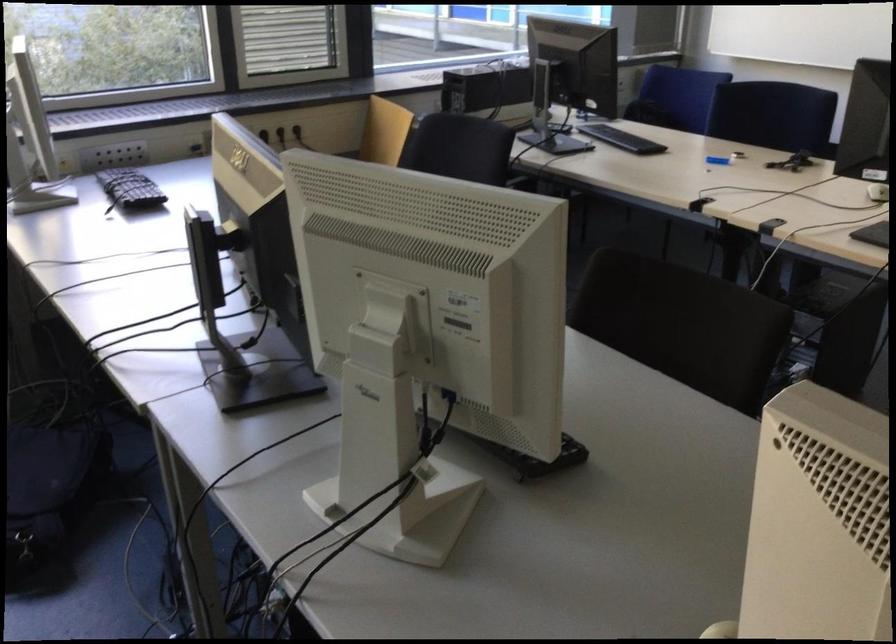
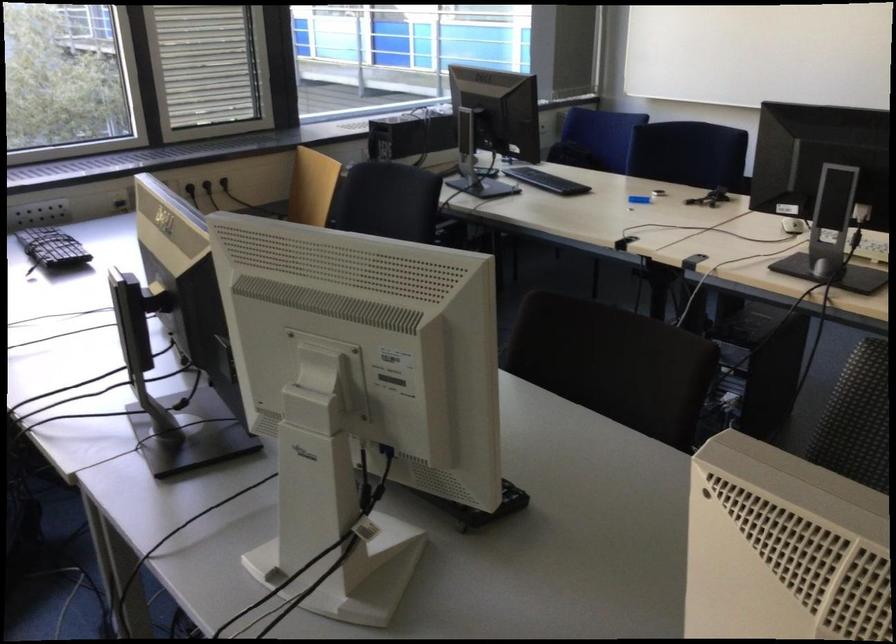
Which direction would the cameraman need to move to produce the second image?

The cameraman walked toward right, backward.